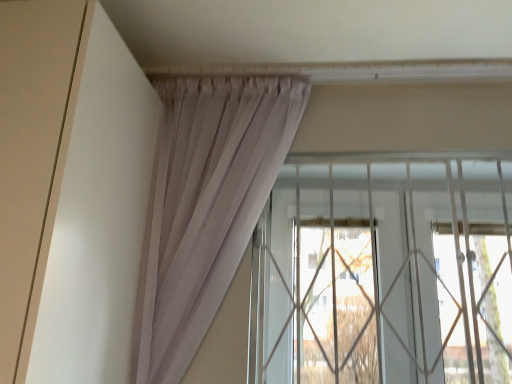
Question: From their relative heights in the image, would you say white matte door at left is taller or shorter than transparent glass window at center?

Choices:
 (A) tall
 (B) short

Answer: (A)

Question: In the image, is white matte door at left on the left side or the right side of transparent glass window at center?

Choices:
 (A) left
 (B) right

Answer: (A)

Question: Is white matte door at left in front of or behind transparent glass window at center in the image?

Choices:
 (A) behind
 (B) front

Answer: (B)

Question: Is transparent glass window at center bigger or smaller than white matte door at left?

Choices:
 (A) big
 (B) small

Answer: (B)

Question: In terms of width, does transparent glass window at center look wider or thinner when compared to white matte door at left?

Choices:
 (A) wide
 (B) thin

Answer: (B)

Question: From the image's perspective, relative to white matte door at left, is transparent glass window at center above or below?

Choices:
 (A) above
 (B) below

Answer: (B)

Question: From a real-world perspective, is transparent glass window at center above or below white matte door at left?

Choices:
 (A) above
 (B) below

Answer: (B)